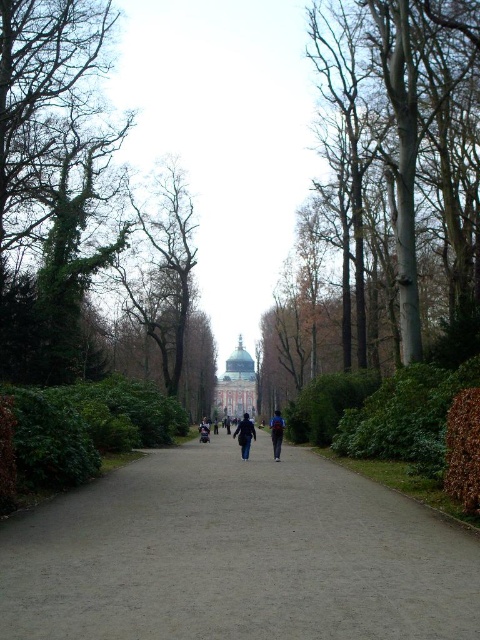
You are a photographer wanting to capture both the dark blue jacket at center and the dark blue jeans at center in a single frame. Since you want both items to be clearly visible, which one should you focus on to ensure the larger object is in sharp focus?

The dark blue jacket at center is larger in size than the dark blue jeans at center, so you should focus on the dark blue jacket at center to ensure it is in sharp focus.